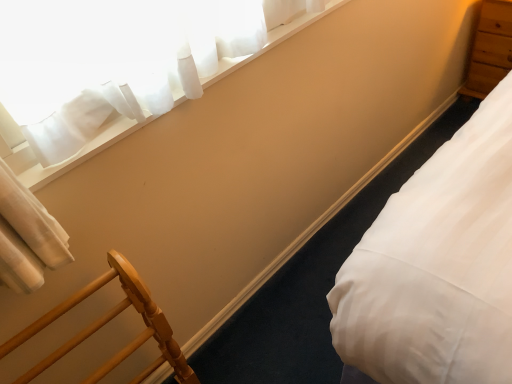
In order to face white sheer curtain at upper left, should I rotate leftwards or rightwards?

To face it directly, rotate left by 3.745 degrees.

The width and height of the screenshot is (512, 384). I want to click on wooden chair at lower left, so click(106, 322).

From the image's perspective, is wooden chair at lower left above or below white sheer curtain at upper left?

From the image's perspective, wooden chair at lower left appears below white sheer curtain at upper left.

Is wooden chair at lower left shorter than white sheer curtain at upper left?

Incorrect, the height of wooden chair at lower left does not fall short of that of white sheer curtain at upper left.

Considering the relative sizes of wooden chair at lower left and white sheer curtain at upper left in the image provided, is wooden chair at lower left wider than white sheer curtain at upper left?

Correct, the width of wooden chair at lower left exceeds that of white sheer curtain at upper left.

From a real-world perspective, relative to white smooth bed at lower right, is wooden chair at lower left vertically above or below?

wooden chair at lower left is above white smooth bed at lower right.

Can you confirm if wooden chair at lower left is smaller than white smooth bed at lower right?

Yes, wooden chair at lower left is smaller than white smooth bed at lower right.

Are wooden chair at lower left and white smooth bed at lower right located far from each other?

That's not correct — wooden chair at lower left is a little close to white smooth bed at lower right.

The width and height of the screenshot is (512, 384). I want to click on bed below the white sheer curtain at upper left (from a real-world perspective), so click(437, 265).

Considering the relative sizes of white sheer curtain at upper left and white smooth bed at lower right in the image provided, is white sheer curtain at upper left smaller than white smooth bed at lower right?

Indeed, white sheer curtain at upper left has a smaller size compared to white smooth bed at lower right.

Do you think white sheer curtain at upper left is within white smooth bed at lower right, or outside of it?

white sheer curtain at upper left cannot be found inside white smooth bed at lower right.

Which is closer, (x=55, y=27) or (x=494, y=301)?

The point (x=494, y=301) is closer.

Can you confirm if white sheer curtain at upper left is shorter than wooden chair at lower left?

Yes.

From the image's perspective, is white sheer curtain at upper left under wooden chair at lower left?

Actually, white sheer curtain at upper left appears above wooden chair at lower left in the image.

Can you confirm if white sheer curtain at upper left is thinner than wooden chair at lower left?

Indeed, white sheer curtain at upper left has a lesser width compared to wooden chair at lower left.

From a real-world perspective, which object stands above the other?

white sheer curtain at upper left, from a real-world perspective.

In the scene shown: Which of these two, white smooth bed at lower right or white sheer curtain at upper left, stands shorter?

Standing shorter between the two is white sheer curtain at upper left.

Based on the photo, which object is further away from the camera taking this photo, white smooth bed at lower right or white sheer curtain at upper left?

white smooth bed at lower right is behind.

Which object is thinner, white smooth bed at lower right or white sheer curtain at upper left?

Thinner between the two is white sheer curtain at upper left.

Is white smooth bed at lower right directly adjacent to white sheer curtain at upper left?

white smooth bed at lower right is not next to white sheer curtain at upper left, and they're not touching.

Is white smooth bed at lower right not inside light brown wood dresser at upper right?

white smooth bed at lower right is positioned outside light brown wood dresser at upper right.

Considering the sizes of objects white smooth bed at lower right and light brown wood dresser at upper right in the image provided, who is wider, white smooth bed at lower right or light brown wood dresser at upper right?

Wider between the two is white smooth bed at lower right.

Considering the positions of objects white smooth bed at lower right and light brown wood dresser at upper right in the image provided, who is more to the left, white smooth bed at lower right or light brown wood dresser at upper right?

white smooth bed at lower right is more to the left.

Does white smooth bed at lower right have a smaller size compared to light brown wood dresser at upper right?

Yes, white smooth bed at lower right is smaller than light brown wood dresser at upper right.

Is white sheer curtain at upper left shorter than light brown wood dresser at upper right?

Correct, white sheer curtain at upper left is not as tall as light brown wood dresser at upper right.

Could you tell me if white sheer curtain at upper left is facing light brown wood dresser at upper right?

No, white sheer curtain at upper left is not turned towards light brown wood dresser at upper right.

Considering the sizes of objects white sheer curtain at upper left and light brown wood dresser at upper right in the image provided, who is thinner, white sheer curtain at upper left or light brown wood dresser at upper right?

With smaller width is white sheer curtain at upper left.

Based on the photo, considering the positions of objects white sheer curtain at upper left and light brown wood dresser at upper right in the image provided, who is behind, white sheer curtain at upper left or light brown wood dresser at upper right?

Positioned behind is light brown wood dresser at upper right.

At what (x,y) coordinates should I click in order to perform the action: click on curtain lying behind the wooden chair at lower left. Please return your answer as a coordinate pair (x, y). Looking at the image, I should click on (125, 33).

This screenshot has width=512, height=384. There is a white smooth bed at lower right. Find the location of `furniture above it (from a real-world perspective)`. furniture above it (from a real-world perspective) is located at coordinates (106, 322).

Considering their positions, is light brown wood dresser at upper right positioned closer to white sheer curtain at upper left than white smooth bed at lower right?

Among the two, white smooth bed at lower right is located nearer to white sheer curtain at upper left.

Which object lies further to the anchor point white smooth bed at lower right, white sheer curtain at upper left or light brown wood dresser at upper right?

light brown wood dresser at upper right.

Which object lies nearer to the anchor point white sheer curtain at upper left, light brown wood dresser at upper right or wooden chair at lower left?

wooden chair at lower left lies closer to white sheer curtain at upper left than the other object.

Considering their positions, is white smooth bed at lower right positioned closer to light brown wood dresser at upper right than white sheer curtain at upper left?

Among the two, white smooth bed at lower right is located nearer to light brown wood dresser at upper right.

Estimate the real-world distances between objects in this image. Which object is further from white sheer curtain at upper left, wooden chair at lower left or light brown wood dresser at upper right?

light brown wood dresser at upper right is positioned further to the anchor white sheer curtain at upper left.

Which object lies nearer to the anchor point wooden chair at lower left, white sheer curtain at upper left or white smooth bed at lower right?

Among the two, white sheer curtain at upper left is located nearer to wooden chair at lower left.

When comparing their distances from white smooth bed at lower right, does light brown wood dresser at upper right or white sheer curtain at upper left seem closer?

white sheer curtain at upper left lies closer to white smooth bed at lower right than the other object.

Based on their spatial positions, is white sheer curtain at upper left or light brown wood dresser at upper right closer to wooden chair at lower left?

white sheer curtain at upper left is closer to wooden chair at lower left.

The width and height of the screenshot is (512, 384). In order to click on bed situated between white sheer curtain at upper left and light brown wood dresser at upper right from left to right in this screenshot , I will do `click(437, 265)`.

Locate an element on the screen. The image size is (512, 384). curtain located between wooden chair at lower left and light brown wood dresser at upper right in the left-right direction is located at coordinates (125, 33).

Where is `curtain between wooden chair at lower left and white smooth bed at lower right`? The width and height of the screenshot is (512, 384). curtain between wooden chair at lower left and white smooth bed at lower right is located at coordinates (125, 33).

The height and width of the screenshot is (384, 512). Find the location of `bed between wooden chair at lower left and light brown wood dresser at upper right`. bed between wooden chair at lower left and light brown wood dresser at upper right is located at coordinates (437, 265).